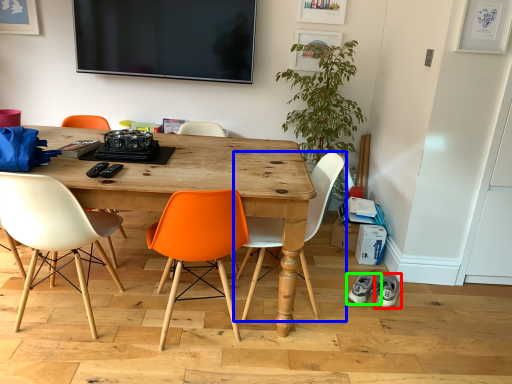
Question: Considering the real-world distances, which object is farthest from footwear (highlighted by a red box)? chair (highlighted by a blue box) or footwear (highlighted by a green box)?

Choices:
 (A) chair
 (B) footwear

Answer: (A)